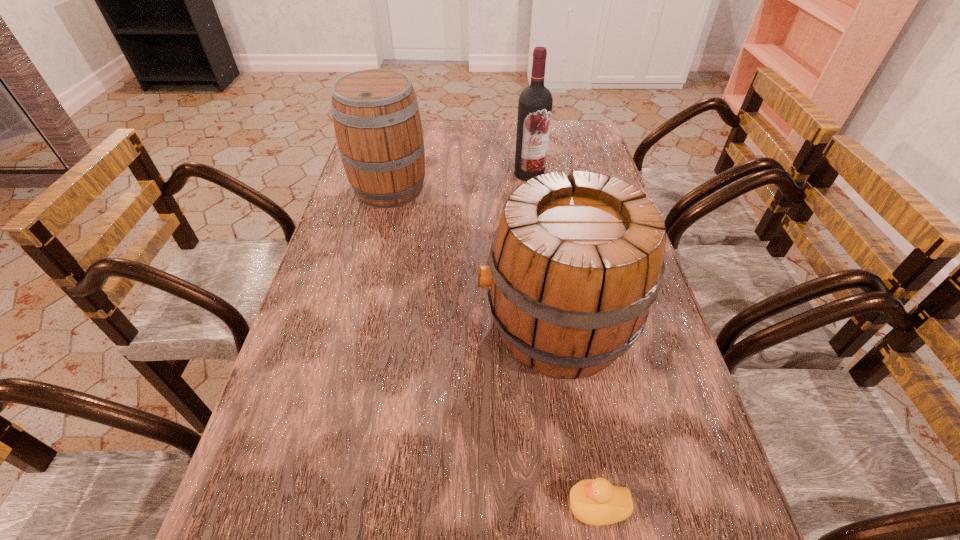
The width and height of the screenshot is (960, 540). I want to click on free space located on the side of the third farthest object where the spigot is located, so click(x=380, y=326).

At what (x,y) coordinates should I click in order to perform the action: click on vacant area located 0.140m on the side of the third farthest object where the spigot is located. Please return your answer as a coordinate pair (x, y). This screenshot has height=540, width=960. Looking at the image, I should click on (416, 326).

The image size is (960, 540). In order to click on vacant position located on the face of the nearest object in this screenshot , I will do `click(471, 506)`.

Locate an element on the screen. free space located 0.380m on the face of the nearest object is located at coordinates (338, 506).

Where is `free region located on the face of the nearest object`? The height and width of the screenshot is (540, 960). free region located on the face of the nearest object is located at coordinates (502, 506).

Identify the location of object positioned at the left edge. This screenshot has width=960, height=540. (377, 123).

The image size is (960, 540). I want to click on object that is at the right edge, so click(x=574, y=265).

Find the location of a particular element. The image size is (960, 540). vacant space at the far edge is located at coordinates (465, 137).

In the image, there is a desktop. In order to click on vacant region at the left edge in this screenshot , I will do `click(328, 289)`.

I want to click on vacant area at the right edge, so click(672, 400).